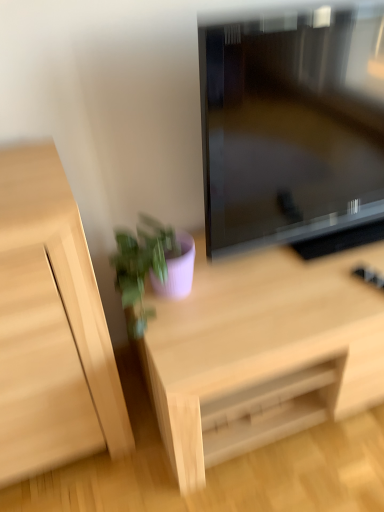
Question: From the image's perspective, is light wood cabinet at left on light wood desk at center?

Choices:
 (A) no
 (B) yes

Answer: (B)

Question: Is light wood cabinet at left positioned far away from light wood desk at center?

Choices:
 (A) no
 (B) yes

Answer: (A)

Question: Is light wood cabinet at left to the right of light wood desk at center from the viewer's perspective?

Choices:
 (A) no
 (B) yes

Answer: (A)

Question: Does light wood cabinet at left have a larger size compared to light wood desk at center?

Choices:
 (A) yes
 (B) no

Answer: (B)

Question: Is light wood cabinet at left further to camera compared to light wood desk at center?

Choices:
 (A) no
 (B) yes

Answer: (A)

Question: Considering their positions, is matte black television at center located in front of or behind matte purple pot at lower center?

Choices:
 (A) behind
 (B) front

Answer: (B)

Question: Is matte black television at center inside the boundaries of matte purple pot at lower center, or outside?

Choices:
 (A) inside
 (B) outside

Answer: (B)

Question: Considering the positions of matte black television at center and matte purple pot at lower center in the image, is matte black television at center bigger or smaller than matte purple pot at lower center?

Choices:
 (A) small
 (B) big

Answer: (B)

Question: From the image's perspective, is matte black television at center above or below matte purple pot at lower center?

Choices:
 (A) below
 (B) above

Answer: (B)

Question: Is light wood cabinet at left spatially inside light wood desk at center, or outside of it?

Choices:
 (A) outside
 (B) inside

Answer: (A)

Question: In the image, is light wood cabinet at left on the left side or the right side of light wood desk at center?

Choices:
 (A) left
 (B) right

Answer: (A)

Question: Relative to light wood desk at center, is light wood cabinet at left in front or behind?

Choices:
 (A) front
 (B) behind

Answer: (A)

Question: Looking at their shapes, would you say light wood cabinet at left is wider or thinner than light wood desk at center?

Choices:
 (A) wide
 (B) thin

Answer: (B)

Question: From the image's perspective, relative to light wood cabinet at left, is light wood desk at center above or below?

Choices:
 (A) above
 (B) below

Answer: (B)

Question: Do you think light wood desk at center is within light wood cabinet at left, or outside of it?

Choices:
 (A) inside
 (B) outside

Answer: (B)